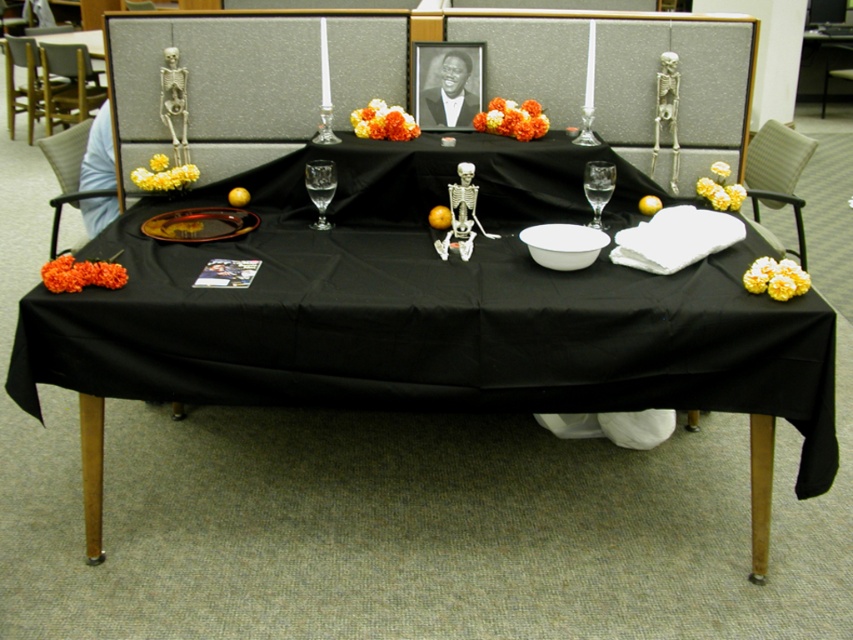
Question: Which point appears farthest from the camera in this image?

Choices:
 (A) (231, 196)
 (B) (433, 209)

Answer: (A)

Question: Is orange marigold bouquet at center positioned behind yellow matte/orange fruit at center?

Choices:
 (A) no
 (B) yes

Answer: (A)

Question: Is black matte table at center closer to camera compared to orange matte/orange at center?

Choices:
 (A) no
 (B) yes

Answer: (B)

Question: Which of the following is the farthest from the observer?

Choices:
 (A) (653, 202)
 (B) (432, 84)
 (C) (425, 138)
 (D) (596, 186)

Answer: (B)

Question: Which point is farther to the camera?

Choices:
 (A) (308, 177)
 (B) (648, 200)

Answer: (B)

Question: Can you confirm if transparent glass at center is positioned to the right of yellow matte/orange fruit at center?

Choices:
 (A) no
 (B) yes

Answer: (B)